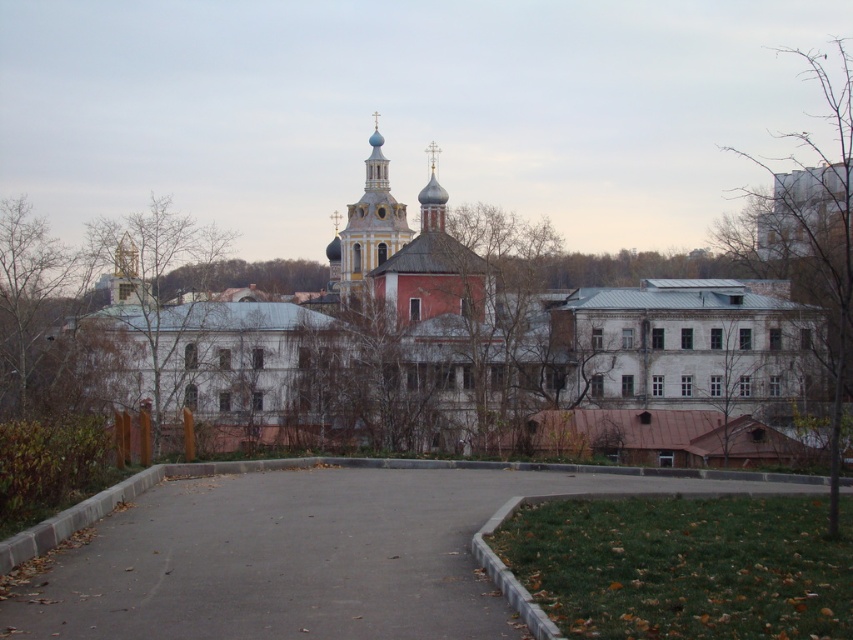
Which is below, gray concrete path at center or brown wood tree at left?

Positioned lower is gray concrete path at center.

Which is more to the right, gray concrete path at center or brown wood tree at left?

From the viewer's perspective, gray concrete path at center appears more on the right side.

Locate an element on the screen. The height and width of the screenshot is (640, 853). gray concrete path at center is located at coordinates (300, 556).

You are a GUI agent. You are given a task and a screenshot of the screen. Output one action in this format:
    pyautogui.click(x=<x>, y=<y>)
    Task: Click on the gray concrete path at center
    The height and width of the screenshot is (640, 853).
    Given the screenshot: What is the action you would take?
    pyautogui.click(x=300, y=556)

Which is below, brown wooden tree at center or gold textured dome at center?

brown wooden tree at center is below.

Does brown wooden tree at center have a greater height compared to gold textured dome at center?

Incorrect, brown wooden tree at center's height is not larger of gold textured dome at center's.

Who is more forward, (688, 392) or (433, 180)?

Point (688, 392) is more forward.

At what (x,y) coordinates should I click in order to perform the action: click on brown wooden tree at center. Please return your answer as a coordinate pair (x, y). Looking at the image, I should click on (729, 369).

Between red brick church at center and brown wood tree at left, which one appears on the right side from the viewer's perspective?

From the viewer's perspective, red brick church at center appears more on the right side.

Who is taller, red brick church at center or brown wood tree at left?

Standing taller between the two is red brick church at center.

This screenshot has height=640, width=853. What do you see at coordinates (451, 346) in the screenshot?
I see `red brick church at center` at bounding box center [451, 346].

The image size is (853, 640). In order to click on red brick church at center in this screenshot , I will do `click(451, 346)`.